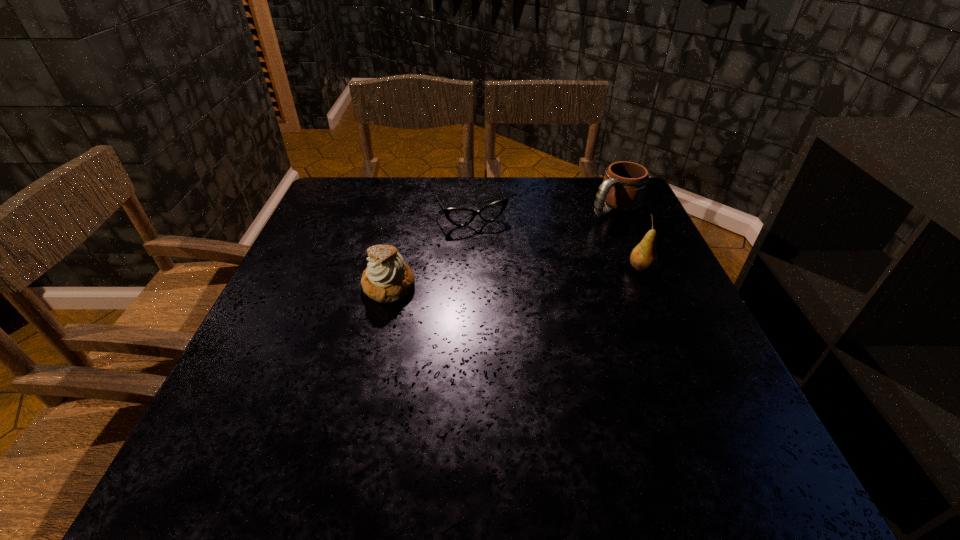
At what (x,y) coordinates should I click in order to perform the action: click on vacant space at the left edge of the desktop. Please return your answer as a coordinate pair (x, y). This screenshot has height=540, width=960. Looking at the image, I should click on (348, 279).

Locate an element on the screen. free space at the right edge of the desktop is located at coordinates (639, 241).

Image resolution: width=960 pixels, height=540 pixels. I want to click on blank space at the far left corner, so click(x=332, y=188).

This screenshot has height=540, width=960. In order to click on vacant space at the far right corner in this screenshot , I will do `click(594, 218)`.

This screenshot has width=960, height=540. I want to click on vacant space that is in between the shortest object and the leftmost object, so click(x=430, y=251).

You are a GUI agent. You are given a task and a screenshot of the screen. Output one action in this format:
    pyautogui.click(x=<x>, y=<y>)
    Task: Click on the free point between the pear and the spectacles
    Image resolution: width=960 pixels, height=540 pixels.
    Given the screenshot: What is the action you would take?
    pyautogui.click(x=556, y=242)

Find the location of a particular element. unoccupied area between the tallest object and the spectacles is located at coordinates (556, 242).

The height and width of the screenshot is (540, 960). In order to click on empty space between the leftmost object and the mug in this screenshot , I will do `click(502, 247)`.

Find the location of `free space between the shortest object and the leftmost object`. free space between the shortest object and the leftmost object is located at coordinates (430, 251).

Locate an element on the screen. vacant area between the pastry and the mug is located at coordinates (502, 247).